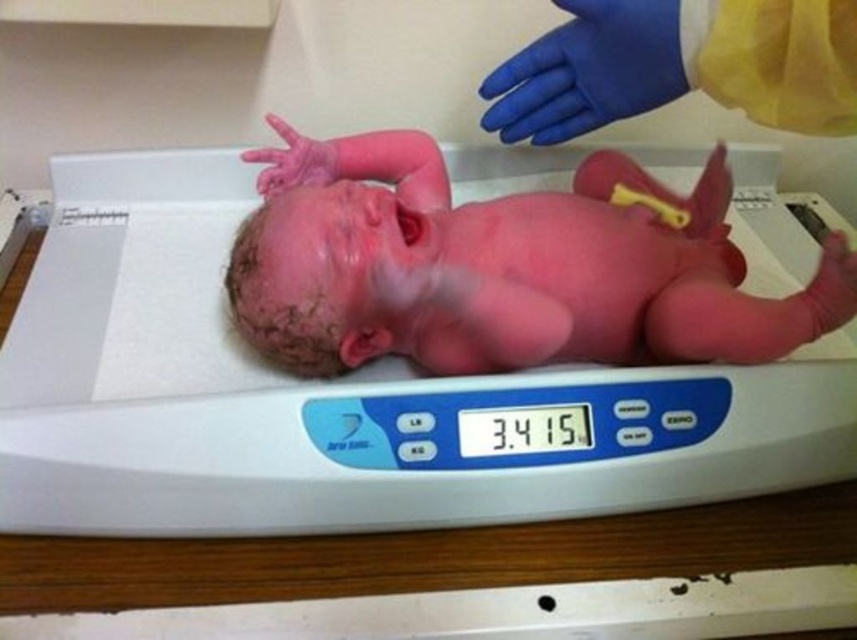
Question: Which point is closer to the camera?

Choices:
 (A) (x=631, y=29)
 (B) (x=300, y=148)

Answer: (A)

Question: Does white plastic scale at center appear over blue rubber glove at upper center?

Choices:
 (A) yes
 (B) no

Answer: (B)

Question: Is pink rubber newborn at center to the left of blue rubber glove at upper center from the viewer's perspective?

Choices:
 (A) no
 (B) yes

Answer: (A)

Question: Which object appears closest to the camera in this image?

Choices:
 (A) blue rubber glove at upper center
 (B) pink rubber newborn at center
 (C) rubber glove at upper center
 (D) white plastic scale at center

Answer: (A)

Question: Among these points, which one is farthest from the camera?

Choices:
 (A) click(693, 353)
 (B) click(316, 150)
 (C) click(538, 129)

Answer: (B)

Question: Does white plastic scale at center have a larger size compared to pink rubber newborn at center?

Choices:
 (A) no
 (B) yes

Answer: (B)